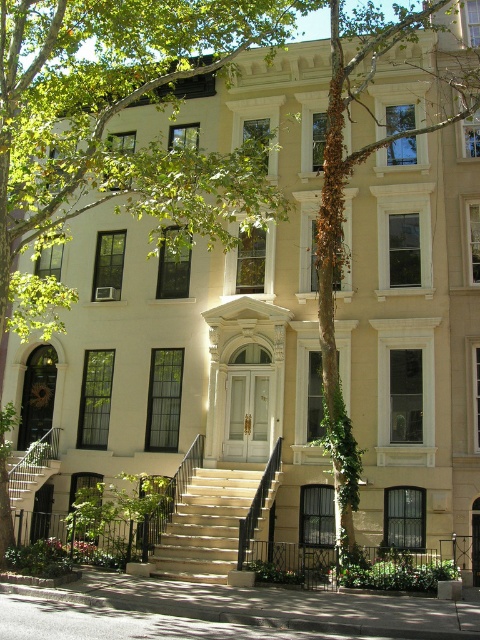
Is beige stone stairs at center to the left of metallic silver staircase at lower left from the viewer's perspective?

In fact, beige stone stairs at center is to the right of metallic silver staircase at lower left.

Between point (164, 556) and point (27, 451), which one is positioned in front?

Point (164, 556) is in front.

Find the location of a particular element. This screenshot has height=640, width=480. beige stone stairs at center is located at coordinates (206, 524).

Does green leafy tree at center appear under metallic silver staircase at lower left?

Incorrect, green leafy tree at center is not positioned below metallic silver staircase at lower left.

Does point (76, 90) lie in front of point (26, 499)?

Yes, point (76, 90) is closer to viewer.

Who is more distant from viewer, (149, 161) or (31, 492)?

Positioned behind is point (31, 492).

At what (x,y) coordinates should I click in order to perform the action: click on green leafy tree at center. Please return your answer as a coordinate pair (x, y). This screenshot has width=480, height=640. Looking at the image, I should click on (116, 132).

Does green leafy tree at center have a greater height compared to beige stone stairs at center?

Yes, green leafy tree at center is taller than beige stone stairs at center.

Who is shorter, green leafy tree at center or beige stone stairs at center?

Standing shorter between the two is beige stone stairs at center.

Locate an element on the screen. This screenshot has width=480, height=640. green leafy tree at center is located at coordinates (116, 132).

Identify the location of green leafy tree at center. This screenshot has height=640, width=480. (116, 132).